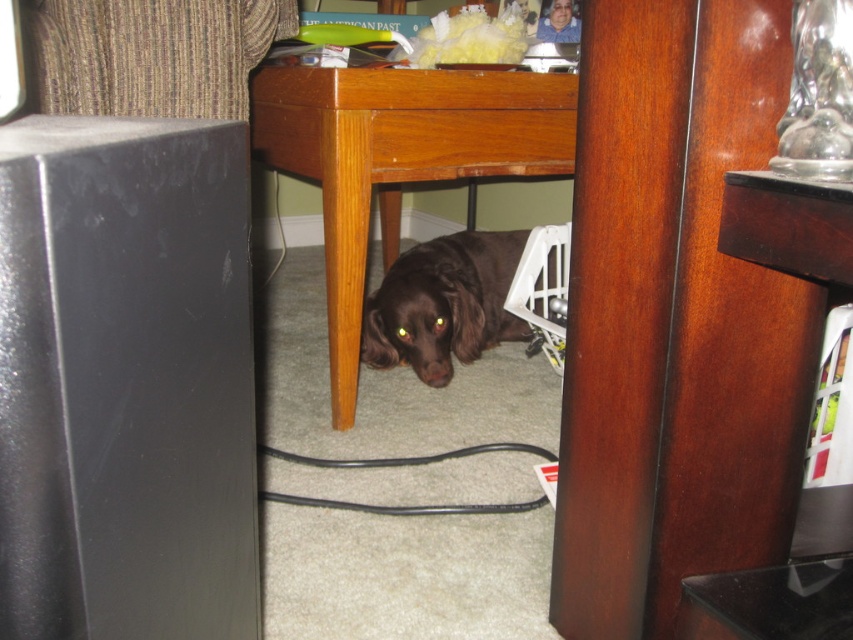
You are standing in the room where the dog is partially hidden under the wooden table. You want to place a small toy exactly at point (398,160). Can you confirm if that point is under the wooden table?

Yes, the wooden table at center is located at point (398,160), so placing the toy there would be under the table.

You are taking a photo of a dog under a table. There are two points marked in the image at coordinates point (502, 176) and point (390, 324). Which point is closer to the camera?

Point (502, 176) is further to the camera than point (390, 324), so point (390, 324) is closer to the camera.

You are standing in the room and want to find the wooden table at center. According to the coordinates provided, where should you look to locate it?

The wooden table at center is located at point (398,160), so you should look towards the lower left area of the room to find it.